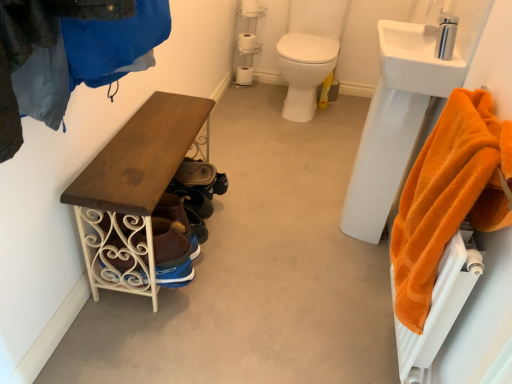
Identify the location of free space on the front side of white plastic shelf at center. (243, 89).